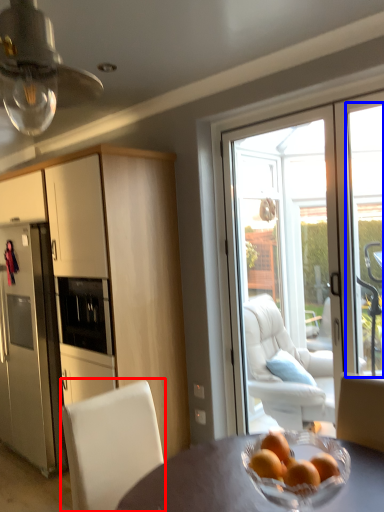
Question: Among these objects, which one is nearest to the camera, chair (highlighted by a red box) or window (highlighted by a blue box)?

Choices:
 (A) chair
 (B) window

Answer: (A)